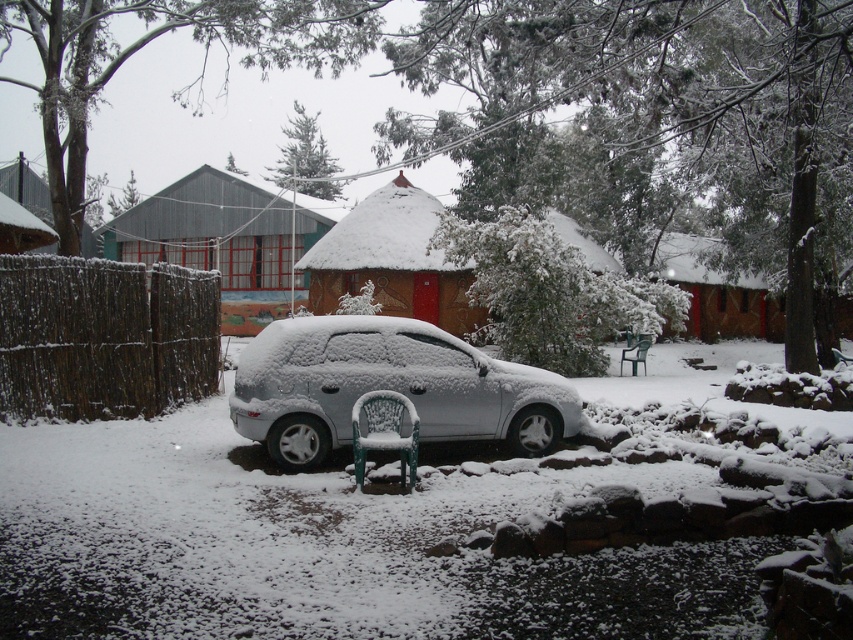
You are planning to build a shed in your backyard and want to choose between a wooden thatched hut at center and a brown thatched hut at center. Based on the image, which one is bigger?

The wooden thatched hut at center is larger in size compared to the brown thatched hut at center, so the wooden thatched hut at center is bigger.

You are a delivery person trying to reach the wooden thatched hut at center. The white matte car at center is blocking your path. Can you walk around the car to get to the hut?

The white matte car at center is in front of wooden thatched hut at center, so you can walk around the car to reach the hut since it is blocking the path but not the entire area.

You are a delivery person needing to park your delivery van, which is 2 meters tall, in this winter scene. The parking spot is between the white matte car at center and the wooden thatched hut at center. Can your van fit vertically between them without touching either?

The white matte car at center is not as tall as wooden thatched hut at center. Since the van is 2 meters tall, we need to know the height of the shorter object. However, the description only states the car is shorter than the hut. Without specific measurements, it is impossible to determine if the van can fit. Please provide more details about their heights.